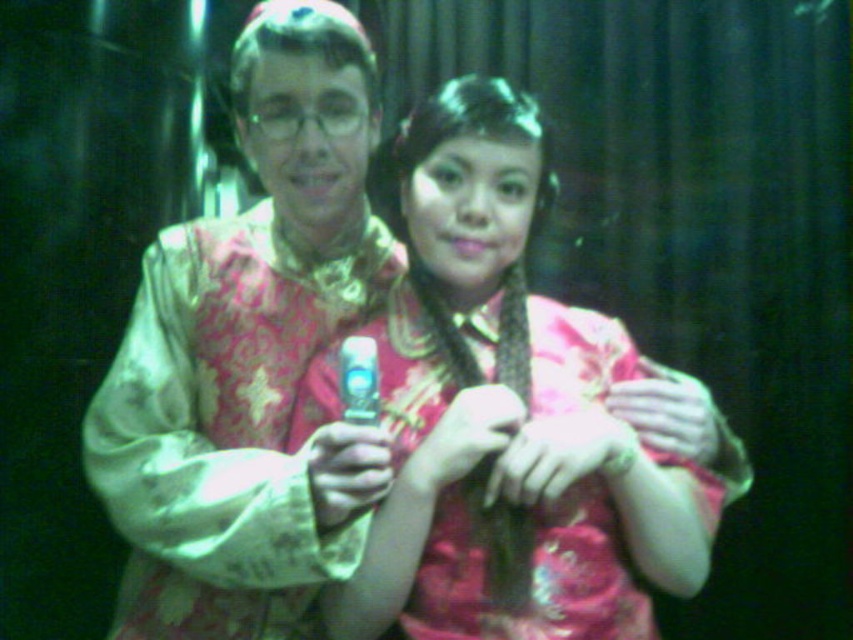
Is pink satin dress at center bigger than shiny metallic phone at center?

Indeed, pink satin dress at center has a larger size compared to shiny metallic phone at center.

Between pink satin dress at center and shiny metallic phone at center, which one is positioned lower?

pink satin dress at center is below.

Does point (534, 300) lie in front of point (322, 84)?

No, (534, 300) is behind (322, 84).

Identify the location of pink satin dress at center. (x=508, y=410).